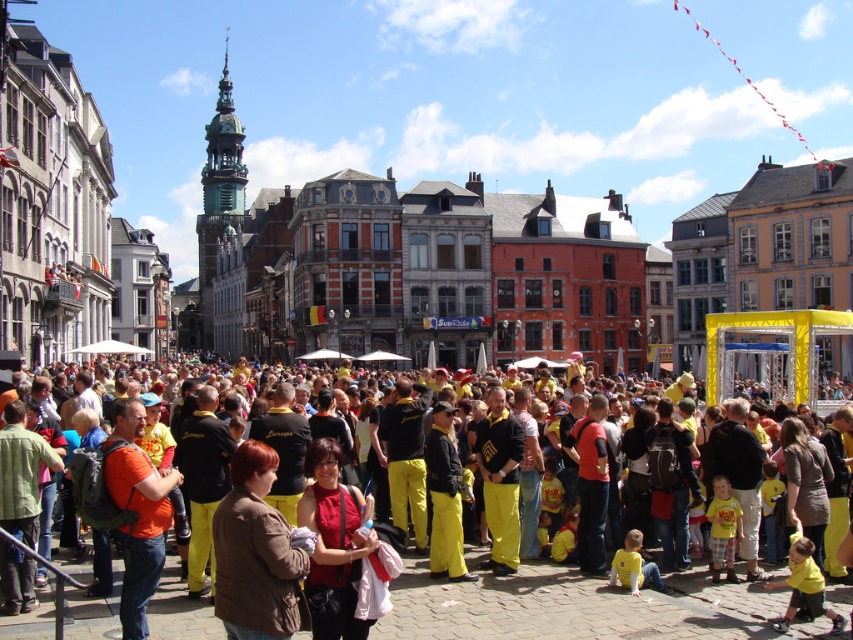
Question: Can you confirm if yellow fabric crowd at center is positioned above matte red blouse at center?

Choices:
 (A) no
 (B) yes

Answer: (B)

Question: Does yellow fabric crowd at center appear on the right side of matte red blouse at center?

Choices:
 (A) yes
 (B) no

Answer: (A)

Question: Estimate the real-world distances between objects in this image. Which object is closer to the brown leather jacket at center?

Choices:
 (A) matte red blouse at center
 (B) yellow fabric crowd at center

Answer: (A)

Question: Which point is farther to the camera?

Choices:
 (A) (215, 548)
 (B) (432, 598)
 (C) (343, 560)

Answer: (B)

Question: Is yellow fabric crowd at center closer to camera compared to brown leather jacket at center?

Choices:
 (A) no
 (B) yes

Answer: (A)

Question: Among these objects, which one is farthest from the camera?

Choices:
 (A) brown leather jacket at center
 (B) matte red blouse at center
 (C) yellow fabric crowd at center

Answer: (B)